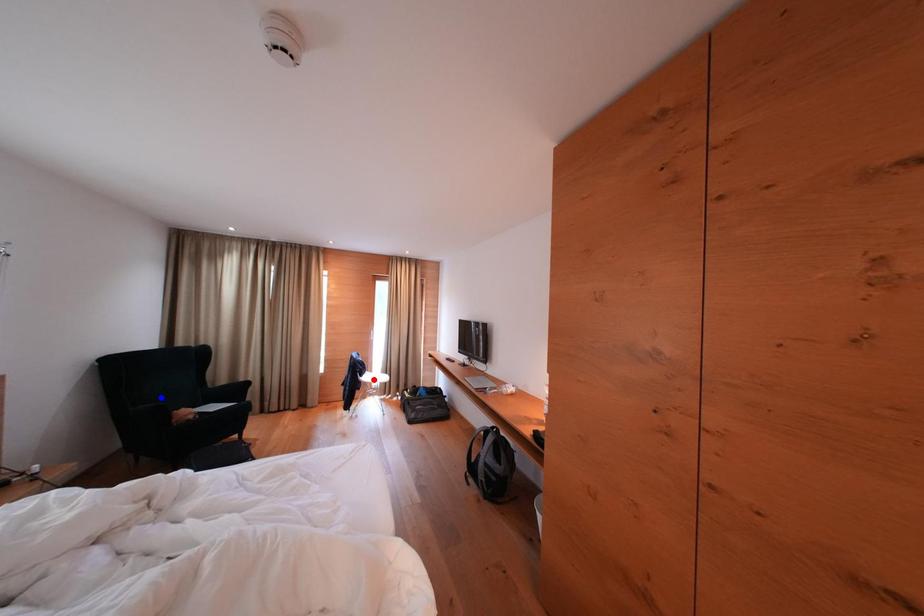
Question: Two points are marked on the image. Which point is closer to the camera?

Choices:
 (A) Blue point is closer.
 (B) Red point is closer.

Answer: (A)